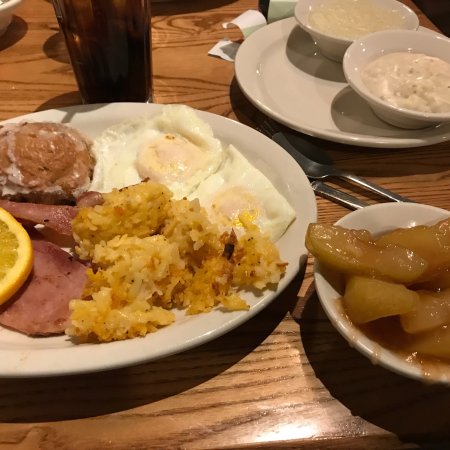
Find the location of `bowl`. bowl is located at coordinates click(385, 357).